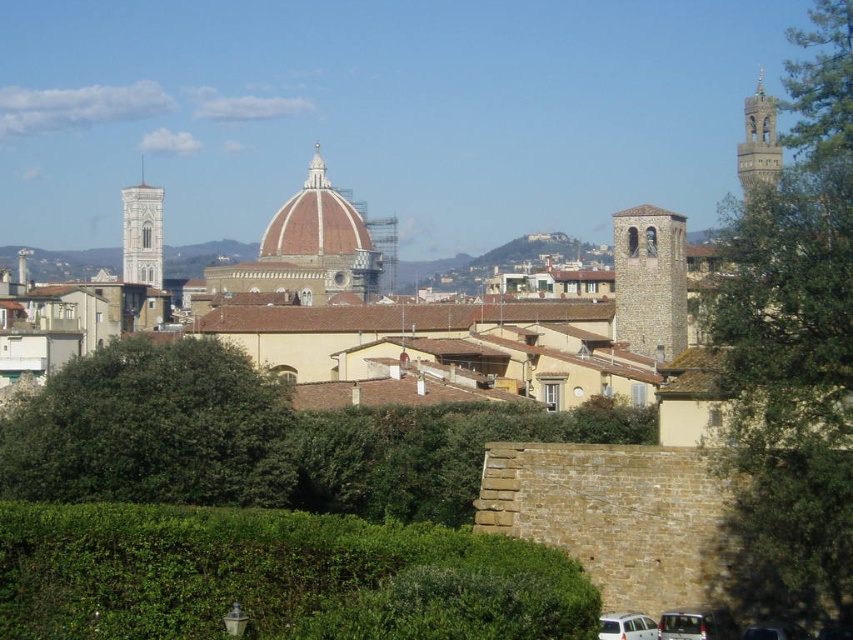
Question: Observing the image, what is the correct spatial positioning of green leafy hedge at lower center in reference to stone bell tower at right?

Choices:
 (A) above
 (B) below

Answer: (B)

Question: Which point appears farthest from the camera in this image?

Choices:
 (A) (683, 346)
 (B) (804, 486)
 (C) (521, 435)

Answer: (A)

Question: Which point is farther from the camera taking this photo?

Choices:
 (A) (154, 221)
 (B) (817, 618)

Answer: (A)

Question: Is green leafy tree at center to the left of metallic silver van at lower right from the viewer's perspective?

Choices:
 (A) no
 (B) yes

Answer: (B)

Question: Is stone bell tower at right closer to the viewer compared to stone bell tower at left?

Choices:
 (A) no
 (B) yes

Answer: (B)

Question: Which point is closer to the camera?

Choices:
 (A) green leafy hedge at center
 (B) green leafy tree at right
 (C) metallic silver van at lower right

Answer: (B)